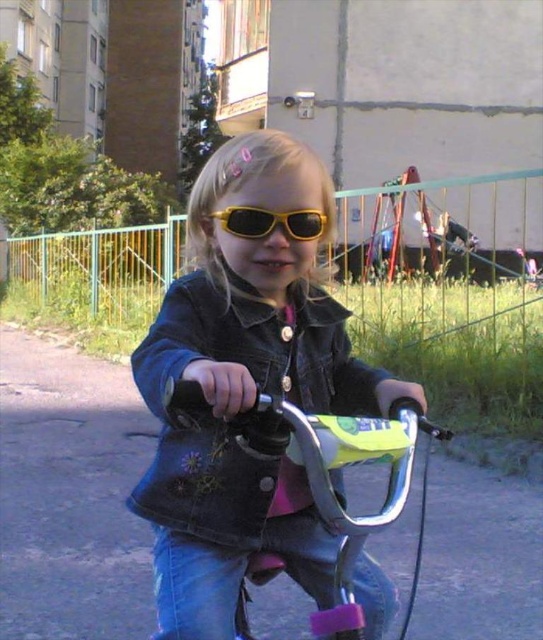
You are standing at the starting point and see two points marked on the path ahead. The first point is at coordinate point (219, 628) and the second point is at coordinate point (251, 227). If you walk straight ahead, which point will you reach first?

Point (219, 628) is in front of point (251, 227), so you will reach point (219, 628) first.

Looking at this image, you are a photographer standing at the path where the child is riding. You want to take a photo that shows both the matte black jacket at center and the metallic silver bicycle handlebars at center. Which object should you focus on first to ensure both are in frame?

The matte black jacket at center is much taller than the metallic silver bicycle handlebars at center, so you should focus on the matte black jacket at center first to ensure both are in frame.